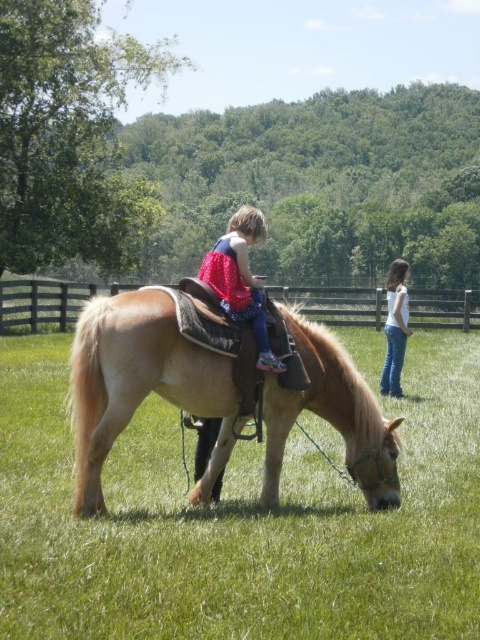
You are a photographer planning to capture a wide shot of the scene. Given that the green grassy field at center and the white denim jeans at right are both in view, which object occupies a larger portion of the image?

The green grassy field at center occupies a larger portion of the image because its width surpasses that of the white denim jeans at right.

You are a photographer standing at the origin point of the coordinate system. You want to take a photo of the light brown leather horse at center. What are the coordinates of the horse?

The coordinates of the light brown leather horse at center are at point (141, 385).

You are a drone operator trying to capture a photo of the young girl riding the pony. The drone is currently hovering above the green grassy field at center. To ensure the girl and pony are in the frame, should you move the drone north or south? Please provide your answer based on the coordinates provided in the scene description.

The green grassy field at center is located at coordinates point (239,522). Since the girl and pony are positioned atop the field, the drone is already above them, so no movement is necessary. The drone should remain in its current position to capture the girl and pony in the frame.